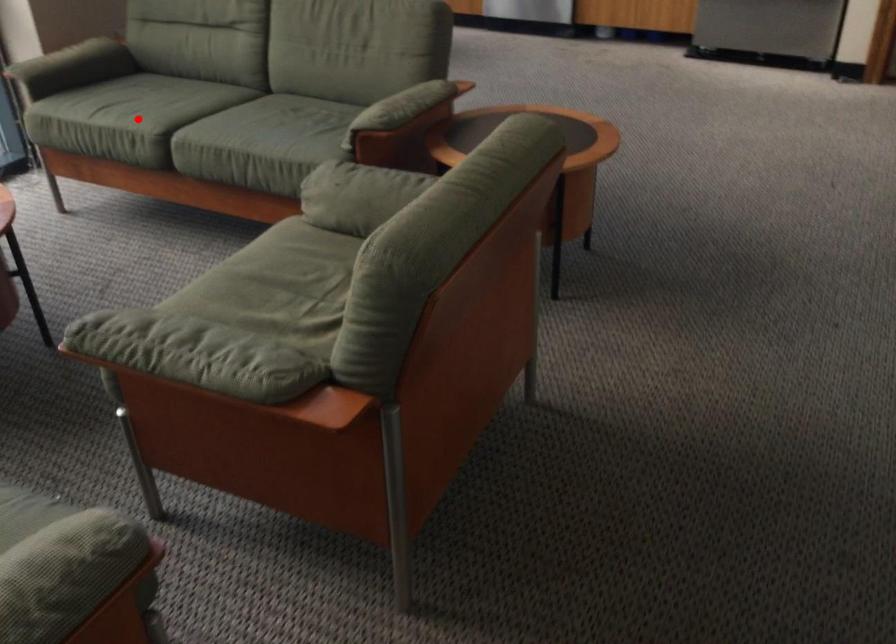
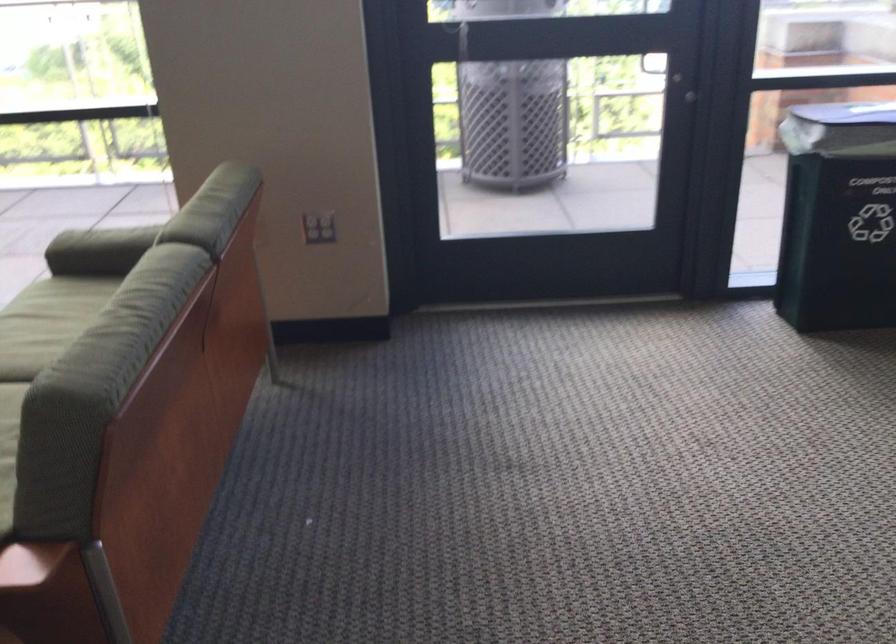
Question: I am providing you with two images of the same scene from different viewpoints. A red point is shown in image1. For the corresponding object point in image2, is it positioned nearer or farther from the camera?

Choices:
 (A) Nearer
 (B) Farther

Answer: (A)